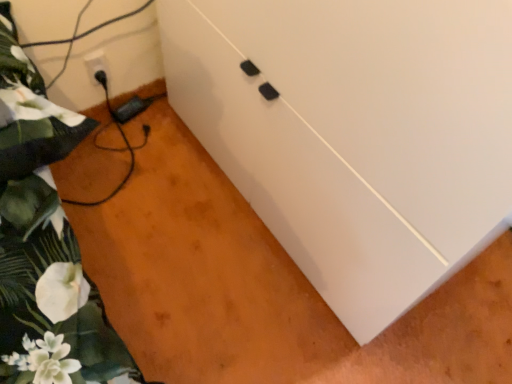
Based on the photo, measure the distance between point (26, 350) and camera.

→ They are 24.61 inches apart.

Where is `white matte cabinet at center`? The image size is (512, 384). white matte cabinet at center is located at coordinates (355, 134).

Identify the location of white plastic electric outlet at lower left. (96, 65).

How different are the orientations of green floral fabric at left and white plastic electric outlet at lower left in degrees?

The angular difference between green floral fabric at left and white plastic electric outlet at lower left is 1.69 degrees.

Who is bigger, green floral fabric at left or white plastic electric outlet at lower left?

With larger size is green floral fabric at left.

From a real-world perspective, is green floral fabric at left physically located above or below white plastic electric outlet at lower left?

green floral fabric at left is above white plastic electric outlet at lower left.

From the image's perspective, which is below, green floral fabric at left or white plastic electric outlet at lower left?

From the image's view, green floral fabric at left is below.

Consider the image. In terms of width, does white matte cabinet at center look wider or thinner when compared to white plastic electric outlet at lower left?

Clearly, white matte cabinet at center has more width compared to white plastic electric outlet at lower left.

From a real-world perspective, is white matte cabinet at center under white plastic electric outlet at lower left?

Incorrect, from a real-world perspective, white matte cabinet at center is higher than white plastic electric outlet at lower left.

Is point (316, 252) positioned before point (104, 58)?

Yes, point (316, 252) is in front of point (104, 58).

Can white matte cabinet at center be found inside white plastic electric outlet at lower left?

Actually, white matte cabinet at center is outside white plastic electric outlet at lower left.

This screenshot has height=384, width=512. I want to click on electric outlet that is on the left side of white matte cabinet at center, so click(96, 65).

In the image, is white plastic electric outlet at lower left positioned in front of or behind white matte cabinet at center?

In the image, white plastic electric outlet at lower left appears behind white matte cabinet at center.

Is the depth of green floral fabric at left less than that of white matte cabinet at center?

No.

From a real-world perspective, who is located higher, green floral fabric at left or white matte cabinet at center?

white matte cabinet at center is physically above.

Can you tell me how much green floral fabric at left and white matte cabinet at center differ in facing direction?

88.6 degrees.

Is green floral fabric at left facing away from white matte cabinet at center?

No, white matte cabinet at center is not at the back of green floral fabric at left.

Is white matte cabinet at center completely or partially outside of green floral fabric at left?

Yes, white matte cabinet at center is located beyond the bounds of green floral fabric at left.

Is the surface of white matte cabinet at center in direct contact with green floral fabric at left?

There is a gap between white matte cabinet at center and green floral fabric at left.

Identify the location of bed below the white matte cabinet at center (from a real-world perspective). (45, 242).

From the image's perspective, relative to green floral fabric at left, is white matte cabinet at center above or below?

white matte cabinet at center is above green floral fabric at left.

Image resolution: width=512 pixels, height=384 pixels. I want to click on electric outlet that is under the green floral fabric at left (from a real-world perspective), so click(96, 65).

Considering the relative sizes of white plastic electric outlet at lower left and green floral fabric at left in the image provided, is white plastic electric outlet at lower left shorter than green floral fabric at left?

Yes, white plastic electric outlet at lower left is shorter than green floral fabric at left.

Would you say white plastic electric outlet at lower left is to the left or to the right of green floral fabric at left in the picture?

Based on their positions, white plastic electric outlet at lower left is located to the left of green floral fabric at left.

In the image, is white plastic electric outlet at lower left positioned in front of or behind green floral fabric at left?

In the image, white plastic electric outlet at lower left appears behind green floral fabric at left.

What are the coordinates of `bed above the white plastic electric outlet at lower left (from a real-world perspective)` in the screenshot? It's located at (45, 242).

You are a GUI agent. You are given a task and a screenshot of the screen. Output one action in this format:
    pyautogui.click(x=<x>, y=<y>)
    Task: Click on the electric outlet that is above the white matte cabinet at center (from the image's perspective)
    The height and width of the screenshot is (384, 512).
    Given the screenshot: What is the action you would take?
    pyautogui.click(x=96, y=65)

When comparing their distances from white matte cabinet at center, does green floral fabric at left or white plastic electric outlet at lower left seem further?

white plastic electric outlet at lower left is positioned further to the anchor white matte cabinet at center.

Based on their spatial positions, is white matte cabinet at center or white plastic electric outlet at lower left further from green floral fabric at left?

white plastic electric outlet at lower left.

Considering their positions, is white plastic electric outlet at lower left positioned further to white matte cabinet at center than green floral fabric at left?

The object further to white matte cabinet at center is white plastic electric outlet at lower left.

Based on their spatial positions, is white plastic electric outlet at lower left or white matte cabinet at center closer to green floral fabric at left?

white matte cabinet at center is positioned closer to the anchor green floral fabric at left.

Estimate the real-world distances between objects in this image. Which object is further from white plastic electric outlet at lower left, white matte cabinet at center or green floral fabric at left?

Among the two, white matte cabinet at center is located further to white plastic electric outlet at lower left.

When comparing their distances from white plastic electric outlet at lower left, does green floral fabric at left or white matte cabinet at center seem further?

The object further to white plastic electric outlet at lower left is white matte cabinet at center.

What are the coordinates of `bed between white matte cabinet at center and white plastic electric outlet at lower left along the z-axis` in the screenshot? It's located at (45, 242).